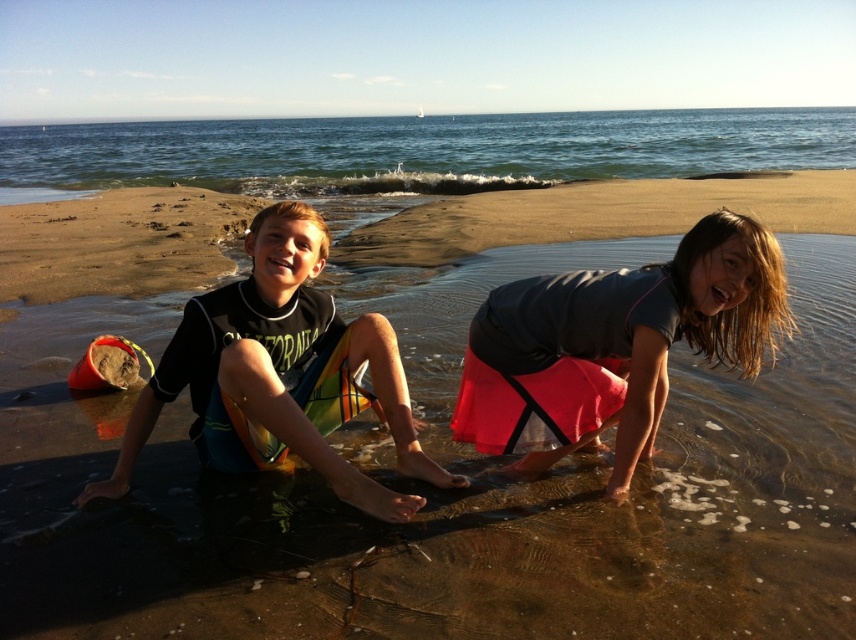
You are a photographer trying to capture the best shot of the beach scene. You notice a point marked at coordinates [438,509]. Based on the scene description, what is located at this point?

The point at coordinates [438,509] marks smooth sand at lower center.

You are a photographer trying to capture both the matte pink skirt at lower right and the black wetsuit at center in a single frame. Which object should you focus on first to ensure both are in the frame?

The matte pink skirt at lower right is thinner than the black wetsuit at center, so you should focus on the black wetsuit at center first to ensure both are in the frame.